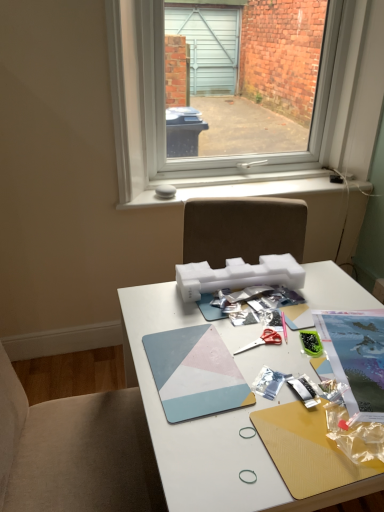
Image resolution: width=384 pixels, height=512 pixels. I want to click on free location in front of red plastic scissors at center, so click(260, 392).